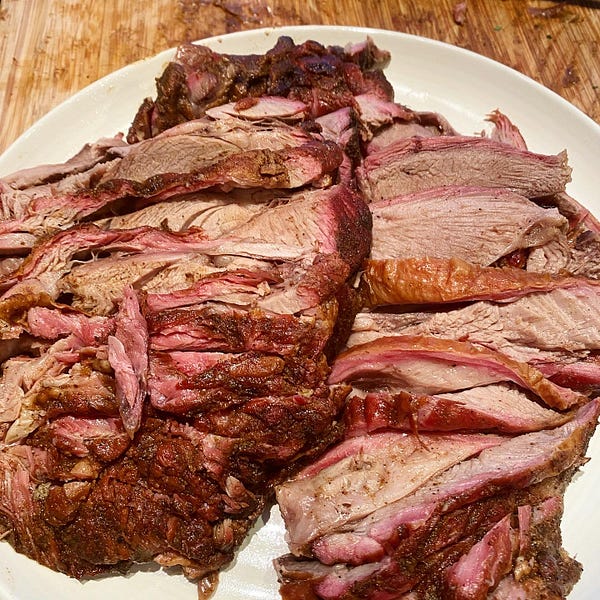
Image resolution: width=600 pixels, height=600 pixels. Find the location of `wood grain`. wood grain is located at coordinates (57, 26).